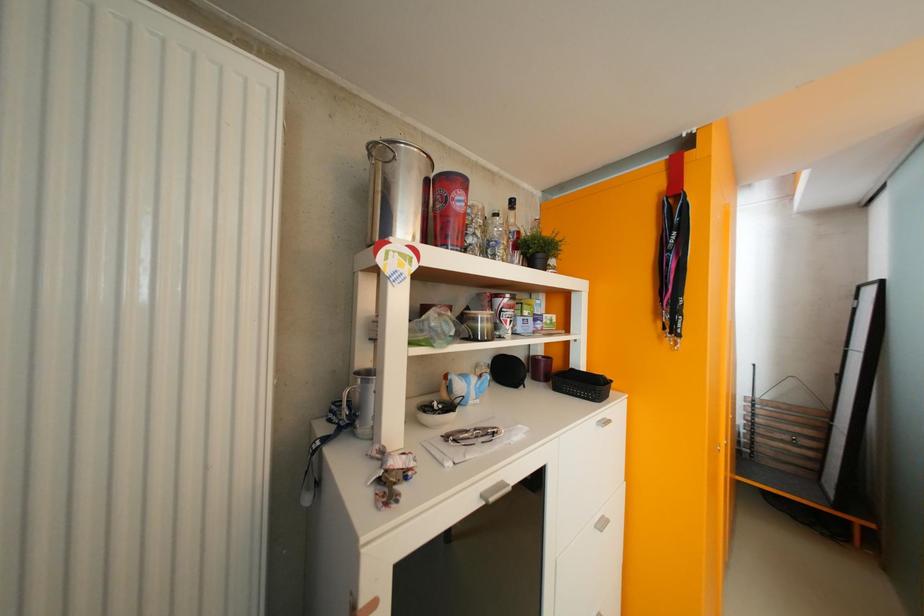
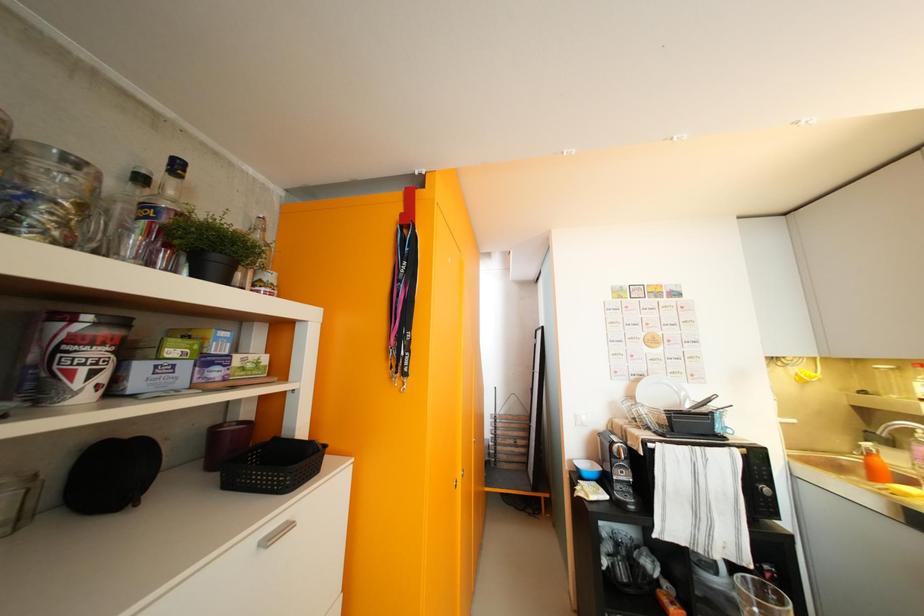
Question: The camera is either moving clockwise (left) or counter-clockwise (right) around the object. The first image is from the beginning of the video and the second image is from the end. Is the camera moving left or right when shooting the video?

Choices:
 (A) Left
 (B) Right

Answer: (A)